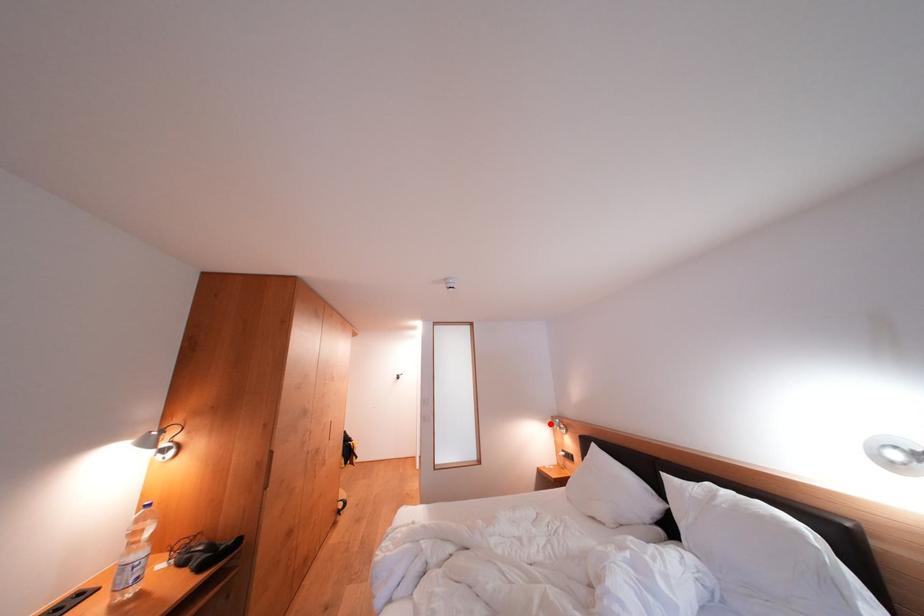
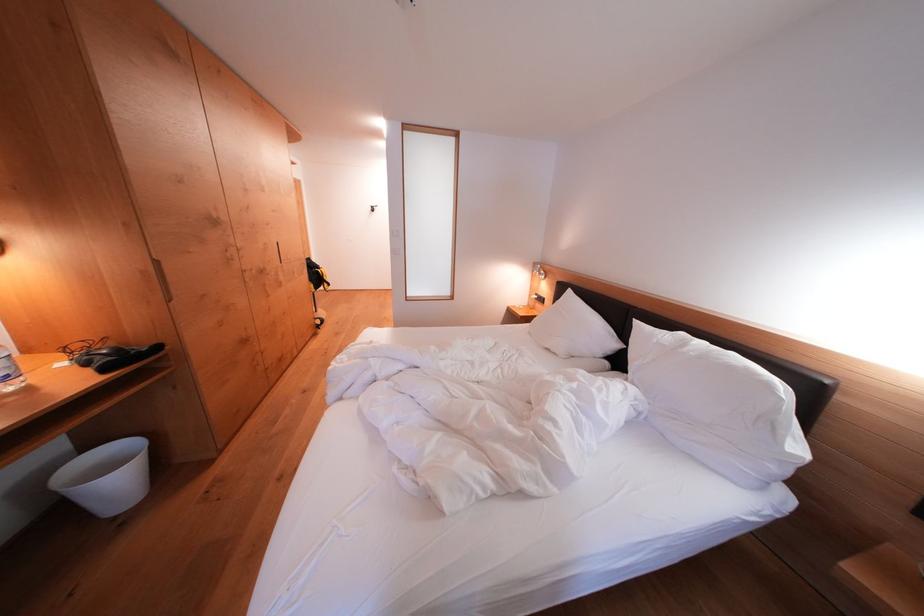
Question: I am providing you with two images of the same scene from different viewpoints. Image1 has a red point marked. In image2, the corresponding 3D location appears at what relative position? Reply with the corresponding letter.

Choices:
 (A) Closer
 (B) Farther

Answer: (A)